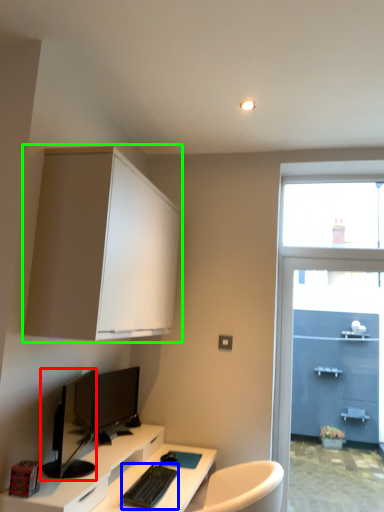
Question: Based on their relative distances, which object is nearer to computer monitor (highlighted by a red box)? Choose from computer keyboard (highlighted by a blue box) and cabinetry (highlighted by a green box).

Choices:
 (A) computer keyboard
 (B) cabinetry

Answer: (A)